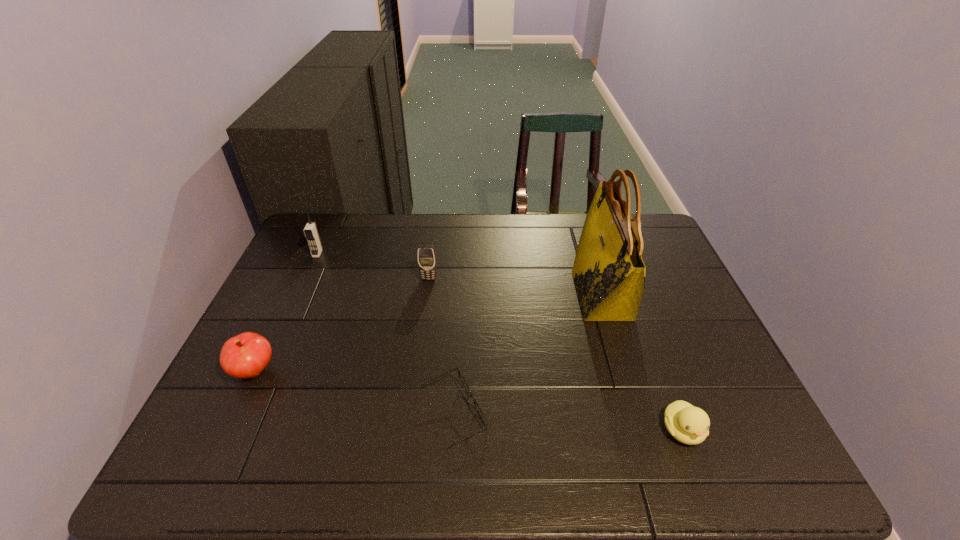
At what (x,y) coordinates should I click in order to perform the action: click on free space that is in between the apple and the tote bag. Please return your answer as a coordinate pair (x, y). The image size is (960, 540). Looking at the image, I should click on 428,333.

I want to click on the second closest object relative to the second shortest object, so click(x=462, y=379).

Locate an element on the screen. The image size is (960, 540). object that ranks as the fourth closest to the tallest object is located at coordinates (x=246, y=355).

I want to click on vacant space that satisfies the following two spatial constraints: 1. on the front-facing side of the tallest object; 2. on the front side of the apple, so click(625, 371).